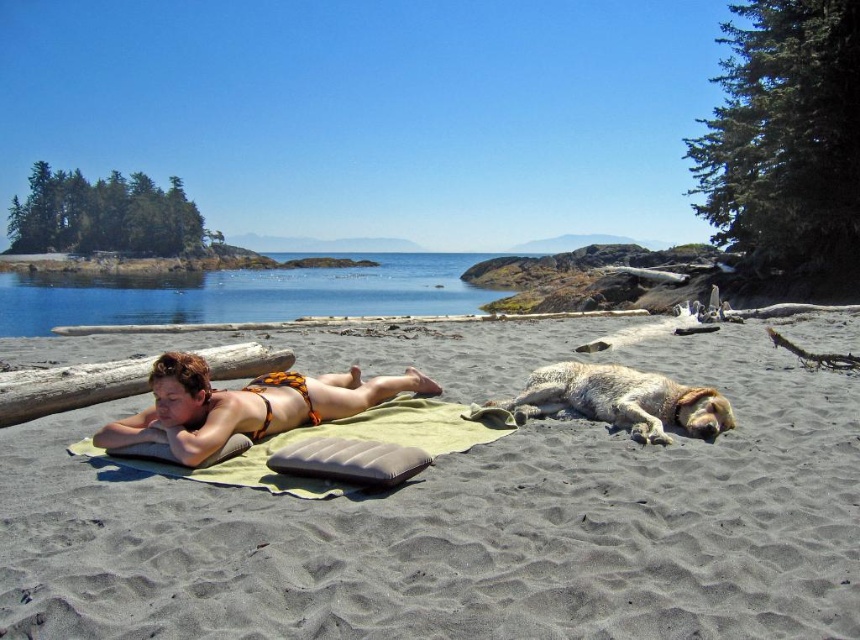
Question: Is clear blue water at center positioned at the back of brown wood log at left?

Choices:
 (A) yes
 (B) no

Answer: (A)

Question: Among these objects, which one is nearest to the camera?

Choices:
 (A) brown wood log at left
 (B) fuzzy white dog at lower right
 (C) green fabric towel at center

Answer: (C)

Question: Which point appears closest to the camera in this image?

Choices:
 (A) (64, 404)
 (B) (740, 392)

Answer: (A)

Question: Is clear blue water at center wider than fuzzy white dog at lower right?

Choices:
 (A) yes
 (B) no

Answer: (A)

Question: Can you confirm if green fabric towel at center is wider than fuzzy white dog at lower right?

Choices:
 (A) yes
 (B) no

Answer: (A)

Question: Among these objects, which one is nearest to the camera?

Choices:
 (A) dark brown sand at center
 (B) fuzzy white dog at lower right
 (C) orange bikini at center

Answer: (A)